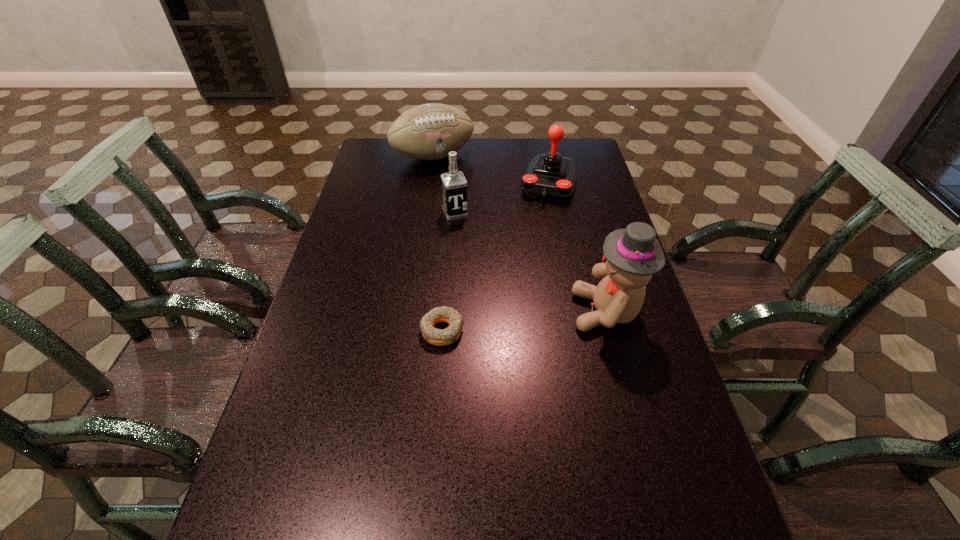
This screenshot has width=960, height=540. Identify the location of vacant area between the joystick and the shortest object. (495, 258).

Where is `vacant area that lies between the doughnut and the joystick`? Image resolution: width=960 pixels, height=540 pixels. vacant area that lies between the doughnut and the joystick is located at coordinates (495, 258).

You are a GUI agent. You are given a task and a screenshot of the screen. Output one action in this format:
    pyautogui.click(x=<x>, y=<y>)
    Task: Click on the fourth closest object to the football (American)
    The height and width of the screenshot is (540, 960).
    Given the screenshot: What is the action you would take?
    pyautogui.click(x=434, y=336)

Identify which object is the second closest to the doughnut. Please provide its 2D coordinates. Your answer should be formatted as a tuple, i.e. [(x, y)], where the tuple contains the x and y coordinates of a point satisfying the conditions above.

[(454, 184)]

You are a GUI agent. You are given a task and a screenshot of the screen. Output one action in this format:
    pyautogui.click(x=<x>, y=<y>)
    Task: Click on the vacant space that satisfies the following two spatial constraints: 1. on the back side of the doughnut; 2. on the left side of the joystick
    
    Given the screenshot: What is the action you would take?
    pyautogui.click(x=453, y=185)

Locate an element on the screen. free space that satisfies the following two spatial constraints: 1. on the front side of the football (American); 2. on the left side of the shortest object is located at coordinates (408, 330).

You are a GUI agent. You are given a task and a screenshot of the screen. Output one action in this format:
    pyautogui.click(x=<x>, y=<y>)
    Task: Click on the vacant space that satisfies the following two spatial constraints: 1. on the back side of the tallest object; 2. on the front-facing side of the doughnut
    This screenshot has height=540, width=960.
    Given the screenshot: What is the action you would take?
    (444, 312)

This screenshot has width=960, height=540. In order to click on free spot that satisfies the following two spatial constraints: 1. on the back side of the rag_doll; 2. on the front-facing side of the shortest object in this screenshot , I will do `click(444, 312)`.

Where is `vacant area that satisfies the following two spatial constraints: 1. on the back side of the shortest object; 2. on the left side of the joystick`? vacant area that satisfies the following two spatial constraints: 1. on the back side of the shortest object; 2. on the left side of the joystick is located at coordinates 453,185.